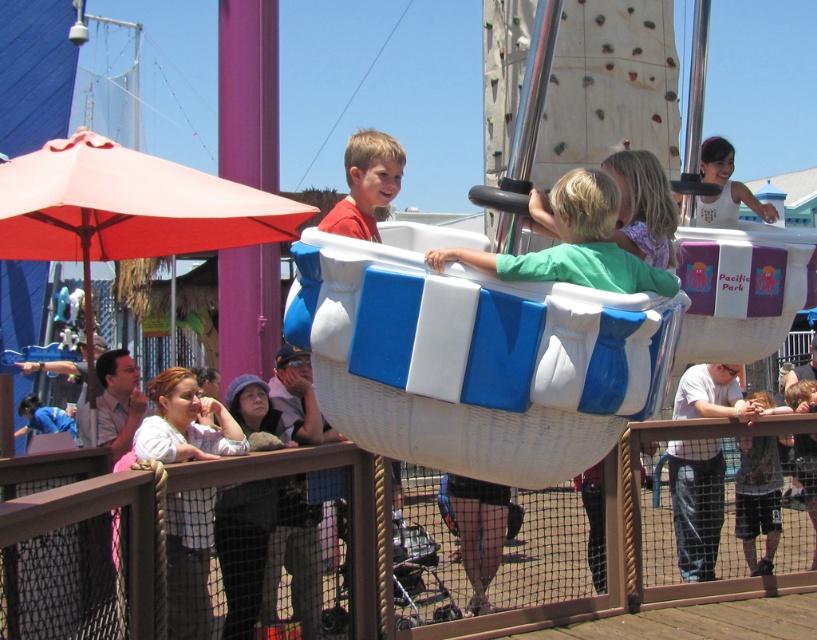
Based on the photo, you are standing at the position of point (x=717, y=449) and want to walk towards the boat ride. There is a point (x=599, y=184) in your path. Can you see the boat ride from your current position?

Yes, because point (x=599, y=184) is in front of point (x=717, y=449), so the boat ride is visible from your current position.

You are a photographer at the fairground. You want to take a photo of both the green matte shirt at center and the white cotton shirt at center so that both are fully visible. Which shirt should you focus on to ensure the shorter one is not cut off?

The green matte shirt at center is shorter than the white cotton shirt at center. To ensure the shorter one is not cut off, focus on framing the photo around the green matte shirt at center first, then include the white cotton shirt at center without cropping either.